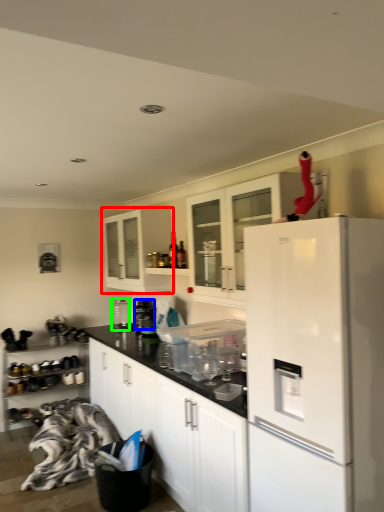
Question: Estimate the real-world distances between objects in this image. Which object is farther from cabinetry (highlighted by a red box), appliance (highlighted by a blue box) or appliance (highlighted by a green box)?

Choices:
 (A) appliance
 (B) appliance

Answer: (B)